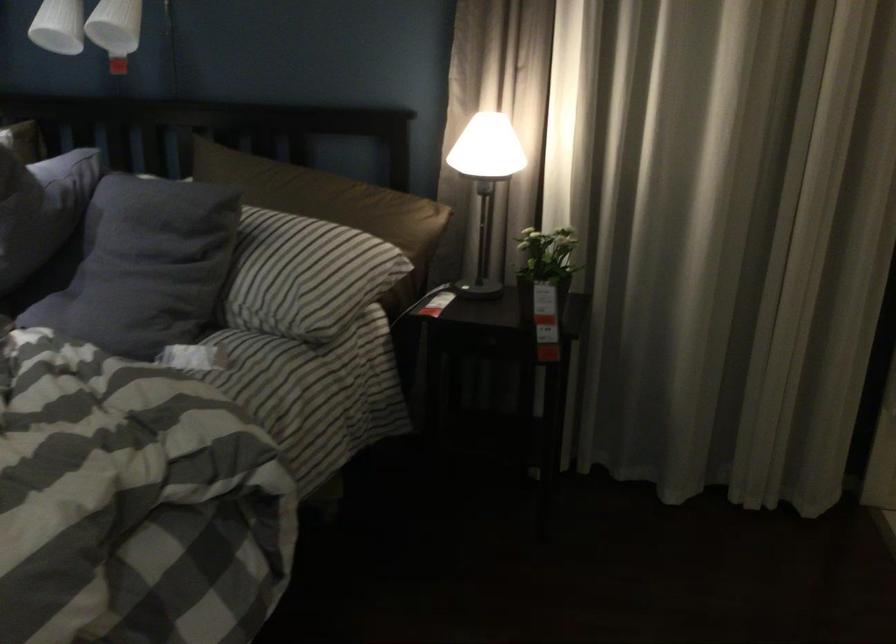
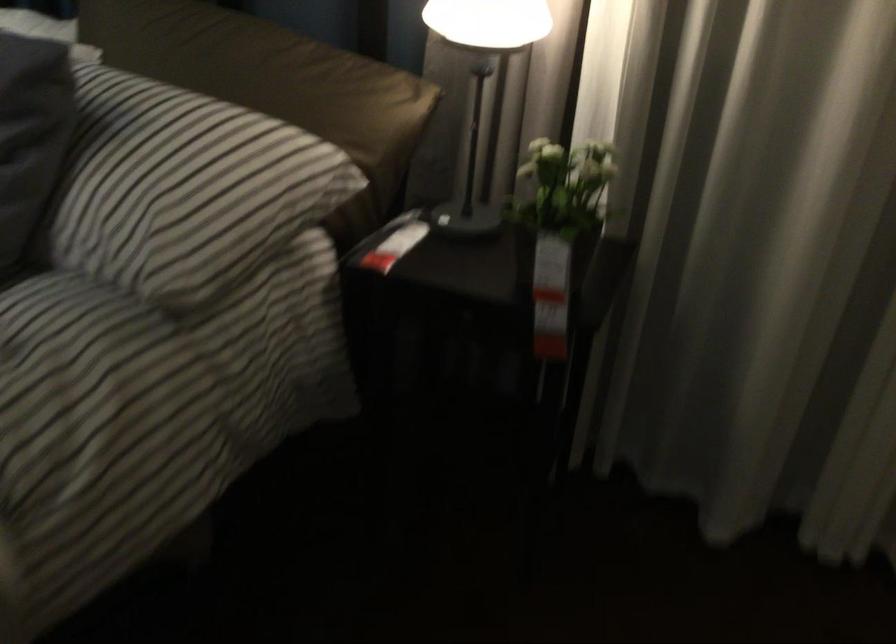
Question: The images are taken continuously from a first-person perspective. In which direction are you moving?

Choices:
 (A) Left
 (B) Right
 (C) Forward
 (D) Backward

Answer: (C)